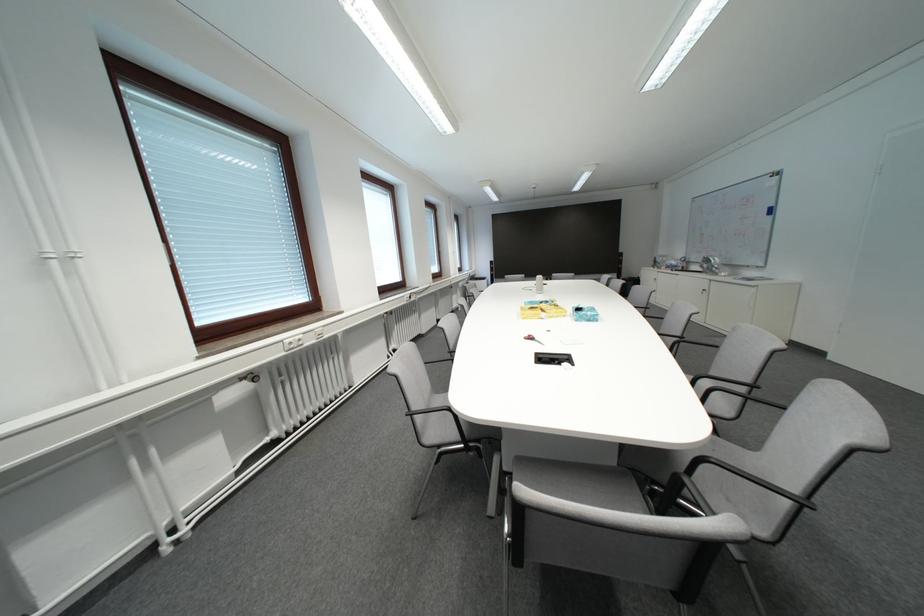
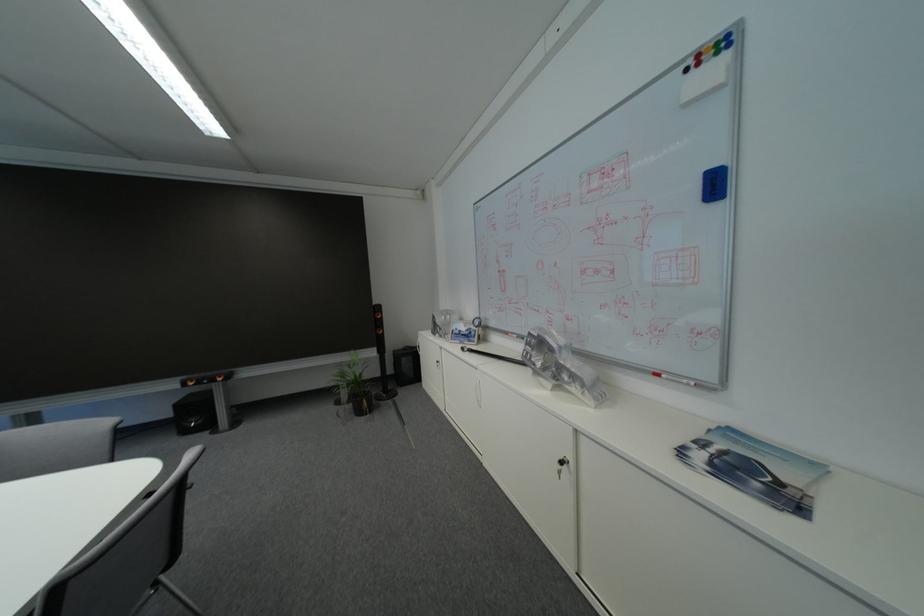
Find the pixel in the second image that matches the point at 624,278 in the first image.

(382, 355)